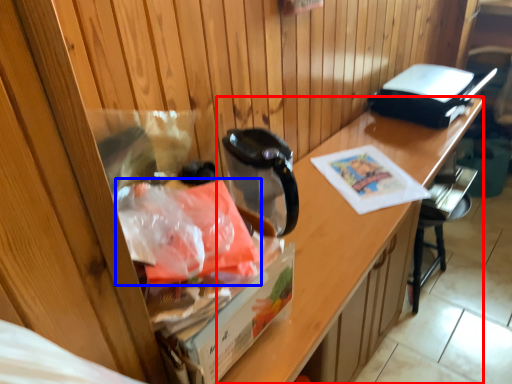
Question: Among these objects, which one is farthest to the camera, desk (highlighted by a red box) or material (highlighted by a blue box)?

Choices:
 (A) desk
 (B) material

Answer: (A)